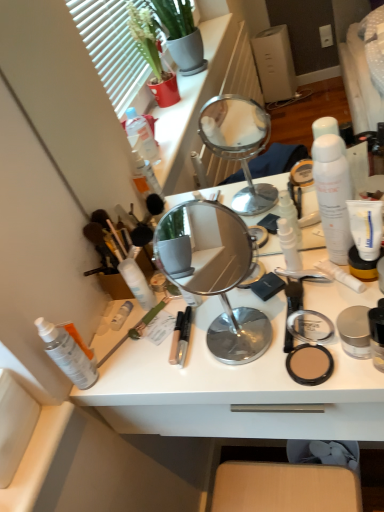
You are a GUI agent. You are given a task and a screenshot of the screen. Output one action in this format:
    pyautogui.click(x=<x>, y=<y>)
    Task: Click on the vacant space in between white matte spray can at left, marked as the fifth toiletry in a right-to-left arrangement, and white matte spray can at upper right, the 6th toiletry viewed from the left
    Image resolution: width=384 pixels, height=512 pixels.
    Given the screenshot: What is the action you would take?
    pyautogui.click(x=218, y=315)